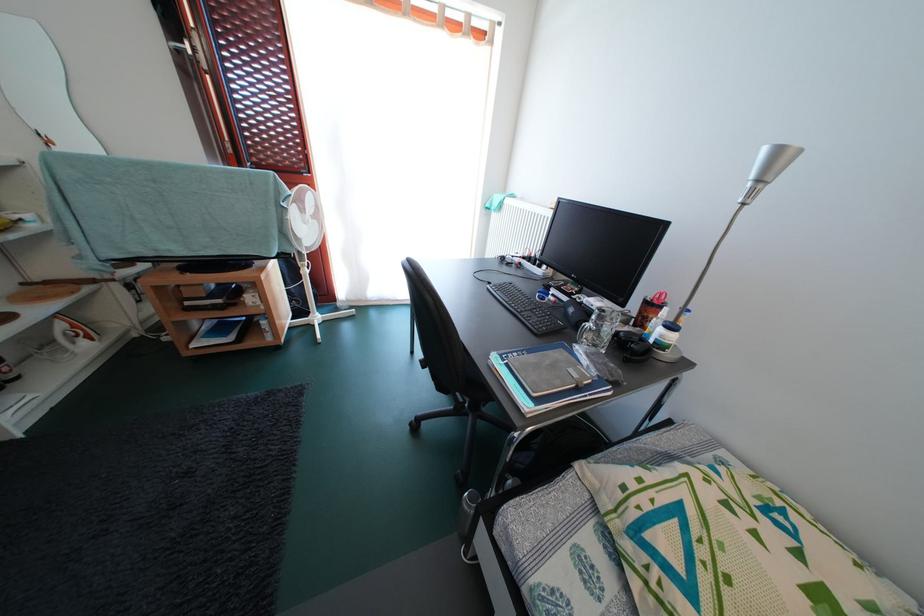
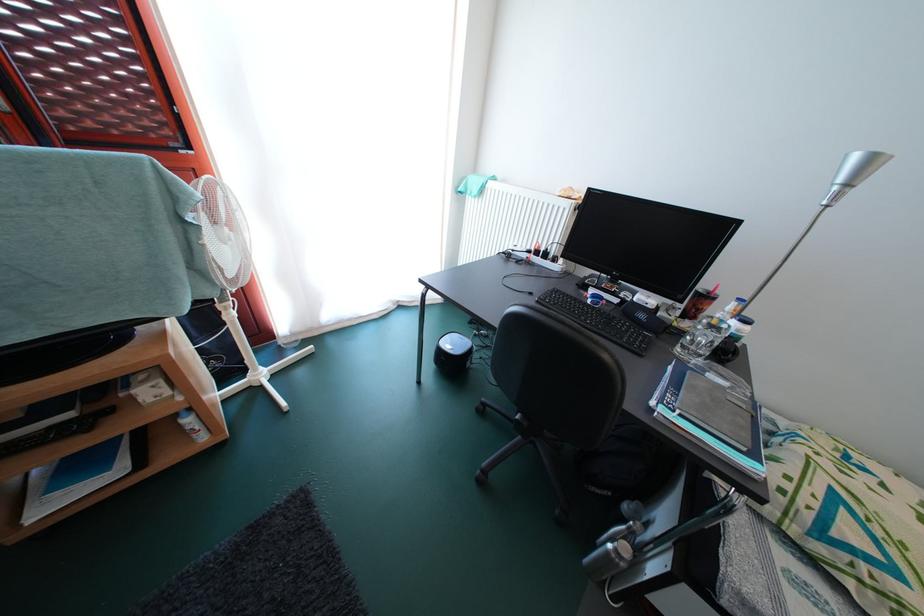
Question: The camera is either moving clockwise (left) or counter-clockwise (right) around the object. The first image is from the beginning of the video and the second image is from the end. Is the camera moving left or right when shooting the video?

Choices:
 (A) Left
 (B) Right

Answer: (A)